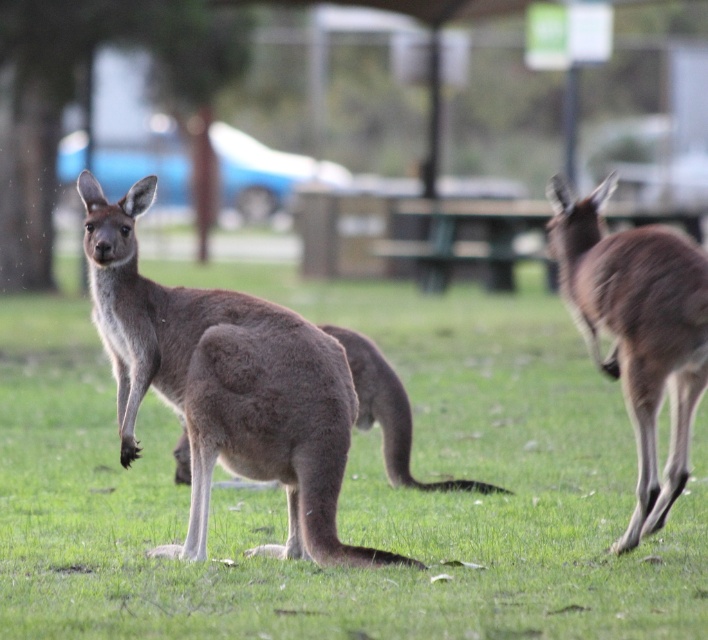
Can you confirm if gray furry kangaroo at center is thinner than brown furry kangaroo at right?

Incorrect, gray furry kangaroo at center's width is not less than brown furry kangaroo at right's.

Is point (207, 305) in front of point (633, 385)?

No, it is behind (633, 385).

Identify the location of gray furry kangaroo at center. The image size is (708, 640). (224, 385).

What do you see at coordinates (346, 486) in the screenshot? I see `brown furry kangaroo at center` at bounding box center [346, 486].

Is point (413, 307) in front of point (624, 289)?

That is False.

Where is `brown furry kangaroo at center`? The image size is (708, 640). brown furry kangaroo at center is located at coordinates (346, 486).

Does brown furry kangaroo at center have a lesser width compared to gray furry kangaroo at center?

No.

Is brown furry kangaroo at center to the right of gray furry kangaroo at center from the viewer's perspective?

Indeed, brown furry kangaroo at center is positioned on the right side of gray furry kangaroo at center.

What are the coordinates of `brown furry kangaroo at center` in the screenshot? It's located at (346, 486).

Where is `brown furry kangaroo at center`? brown furry kangaroo at center is located at coordinates (346, 486).